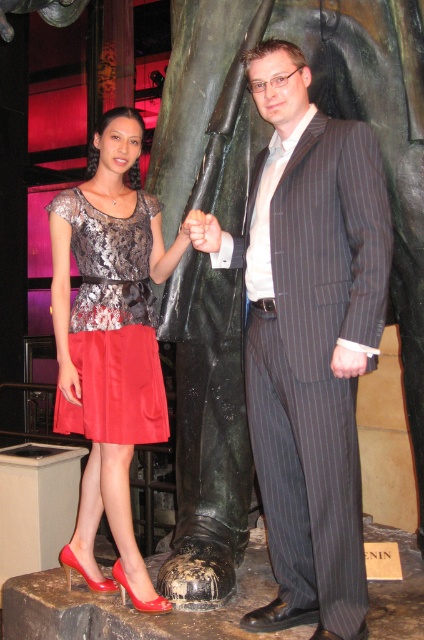
Question: Does satin dress at left have a smaller size compared to smooth skin hand at center?

Choices:
 (A) yes
 (B) no

Answer: (B)

Question: In this image, where is striped pinstripe suit at center located relative to smooth skin hand at center?

Choices:
 (A) right
 (B) left

Answer: (A)

Question: Among these points, which one is farthest from the camera?

Choices:
 (A) (136, 429)
 (B) (184, 221)
 (C) (325, 182)

Answer: (A)

Question: Observing the image, what is the correct spatial positioning of satin red dress at center in reference to smooth skin hand at center?

Choices:
 (A) above
 (B) below

Answer: (B)

Question: Which of the following is the closest to the observer?

Choices:
 (A) (128, 564)
 (B) (195, 220)

Answer: (B)

Question: Which object appears closest to the camera in this image?

Choices:
 (A) satin dress at left
 (B) smooth skin hand at center

Answer: (B)